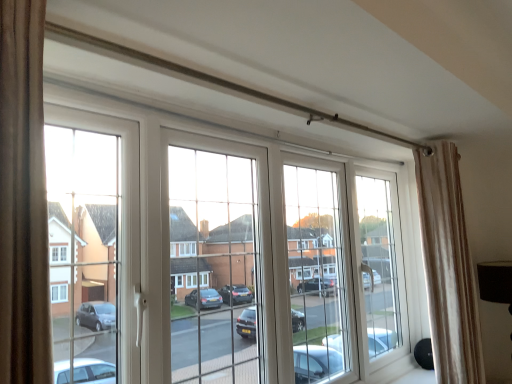
What is the approximate width of beige striped curtain at right?

The width of beige striped curtain at right is 6.78 inches.

I want to click on beige striped curtain at right, so click(448, 267).

Describe the element at coordinates (448, 267) in the screenshot. The image size is (512, 384). I see `beige striped curtain at right` at that location.

In order to face beige striped curtain at right, should I rotate leftwards or rightwards?

Rotate your view right by about 24.971°.

What are the coordinates of `white plastic window at center` in the screenshot? It's located at (404, 252).

Describe the element at coordinates (404, 252) in the screenshot. This screenshot has width=512, height=384. I see `white plastic window at center` at that location.

In order to face white plastic window at center, should I rotate leftwards or rightwards?

To face it directly, rotate right by 3.757 degrees.

Identify the location of beige striped curtain at right. Image resolution: width=512 pixels, height=384 pixels. (x=448, y=267).

Can you confirm if beige striped curtain at right is positioned to the left of white plastic window at center?

Incorrect, beige striped curtain at right is not on the left side of white plastic window at center.

Is beige striped curtain at right closer to camera compared to white plastic window at center?

No, beige striped curtain at right is behind white plastic window at center.

Which is closer to the camera, (418,174) or (403,250)?

The point (418,174) is in front.

From the image's perspective, between beige striped curtain at right and white plastic window at center, who is located below?

beige striped curtain at right.

From a real-world perspective, which object stands above the other?

From a 3D spatial view, white plastic window at center is above.

Considering the relative sizes of beige striped curtain at right and white plastic window at center in the image provided, is beige striped curtain at right thinner than white plastic window at center?

In fact, beige striped curtain at right might be wider than white plastic window at center.

Looking at this image, considering the relative sizes of beige striped curtain at right and white plastic window at center in the image provided, is beige striped curtain at right shorter than white plastic window at center?

Incorrect, the height of beige striped curtain at right does not fall short of that of white plastic window at center.

Looking at the image, does beige striped curtain at right seem bigger or smaller compared to white plastic window at center?

Considering their sizes, beige striped curtain at right takes up less space than white plastic window at center.

Is beige striped curtain at right inside or outside of white plastic window at center?

beige striped curtain at right lies outside white plastic window at center.

Is beige striped curtain at right next to white plastic window at center?

No, beige striped curtain at right is not making contact with white plastic window at center.

Could you tell me if beige striped curtain at right is turned towards white plastic window at center?

No, beige striped curtain at right is not facing towards white plastic window at center.

Can you tell me how much beige striped curtain at right and white plastic window at center differ in facing direction?

There is a 0.892-degree angle between the facing directions of beige striped curtain at right and white plastic window at center.

This screenshot has height=384, width=512. In order to click on curtain that appears below the white plastic window at center (from a real-world perspective) in this screenshot , I will do `click(448, 267)`.

Based on the photo, is white plastic window at center to the left of beige striped curtain at right from the viewer's perspective?

Yes.

Is white plastic window at center in front of or behind beige striped curtain at right in the image?

Clearly, white plastic window at center is in front of beige striped curtain at right.

Considering the positions of points (150, 113) and (446, 272), is point (150, 113) farther from camera compared to point (446, 272)?

No, (150, 113) is in front of (446, 272).

From the image's perspective, between white plastic window at center and beige striped curtain at right, which one is located above?

white plastic window at center.

From a real-world perspective, who is located lower, white plastic window at center or beige striped curtain at right?

In real-world perspective, beige striped curtain at right is lower.

Is white plastic window at center thinner than beige striped curtain at right?

Indeed, white plastic window at center has a lesser width compared to beige striped curtain at right.

Is white plastic window at center shorter than beige striped curtain at right?

Yes.

Between white plastic window at center and beige striped curtain at right, which one has larger size?

white plastic window at center.

Can we say white plastic window at center lies outside beige striped curtain at right?

white plastic window at center lies outside beige striped curtain at right's area.

Is the surface of white plastic window at center in direct contact with beige striped curtain at right?

white plastic window at center is not next to beige striped curtain at right, and they're not touching.

Is white plastic window at center facing towards beige striped curtain at right?

Yes.

What are the coordinates of `curtain directly beneath the white plastic window at center (from a real-world perspective)` in the screenshot? It's located at (448, 267).

At what (x,y) coordinates should I click in order to perform the action: click on curtain that appears below the white plastic window at center (from a real-world perspective). Please return your answer as a coordinate pair (x, y). Looking at the image, I should click on (448, 267).

Where is `window located above the beige striped curtain at right (from a real-world perspective)`? This screenshot has height=384, width=512. window located above the beige striped curtain at right (from a real-world perspective) is located at coordinates (404, 252).